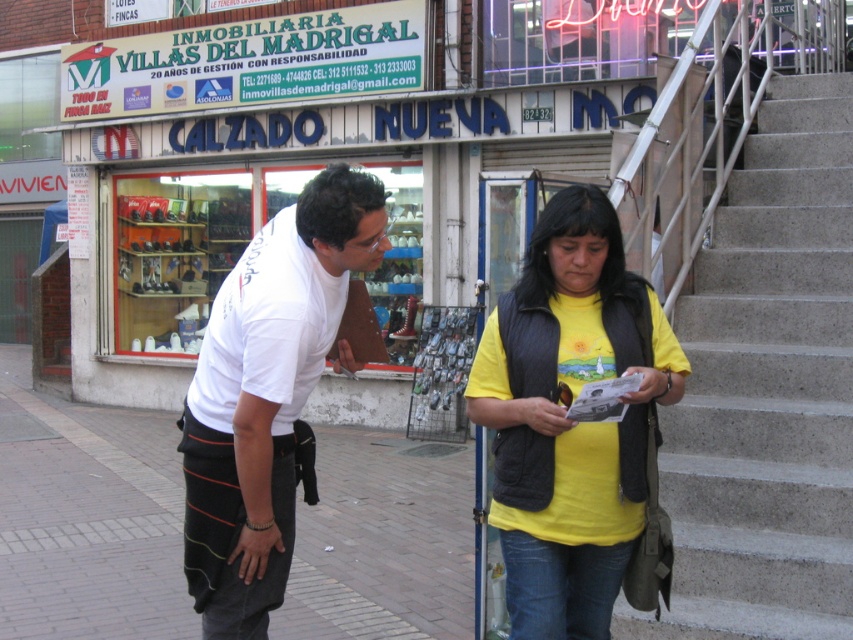
Is point (704, 467) positioned behind point (152, 529)?

No.

Who is shorter, concrete stairs at right or brick pavement at lower left?

Standing shorter between the two is brick pavement at lower left.

Which is in front, point (764, 408) or point (105, 508)?

Point (764, 408)

Where is `concrete stairs at right`? This screenshot has width=853, height=640. concrete stairs at right is located at coordinates (767, 388).

Is point (820, 612) behind point (596, 252)?

Yes, it is behind point (596, 252).

Can you confirm if concrete stairs at right is taller than yellow matte vest at center?

Yes.

Between point (699, 476) and point (532, 502), which one is positioned in front?

Point (532, 502) is in front.

You are a GUI agent. You are given a task and a screenshot of the screen. Output one action in this format:
    pyautogui.click(x=<x>, y=<y>)
    Task: Click on the concrete stairs at right
    This screenshot has width=853, height=640.
    Given the screenshot: What is the action you would take?
    pyautogui.click(x=767, y=388)

Looking at this image, does concrete stairs at right appear over white cotton t-shirt at center?

Yes, concrete stairs at right is above white cotton t-shirt at center.

Measure the distance between point (x=767, y=550) and camera.

A distance of 11.70 feet exists between point (x=767, y=550) and camera.

Image resolution: width=853 pixels, height=640 pixels. I want to click on concrete stairs at right, so click(x=767, y=388).

I want to click on concrete stairs at right, so click(767, 388).